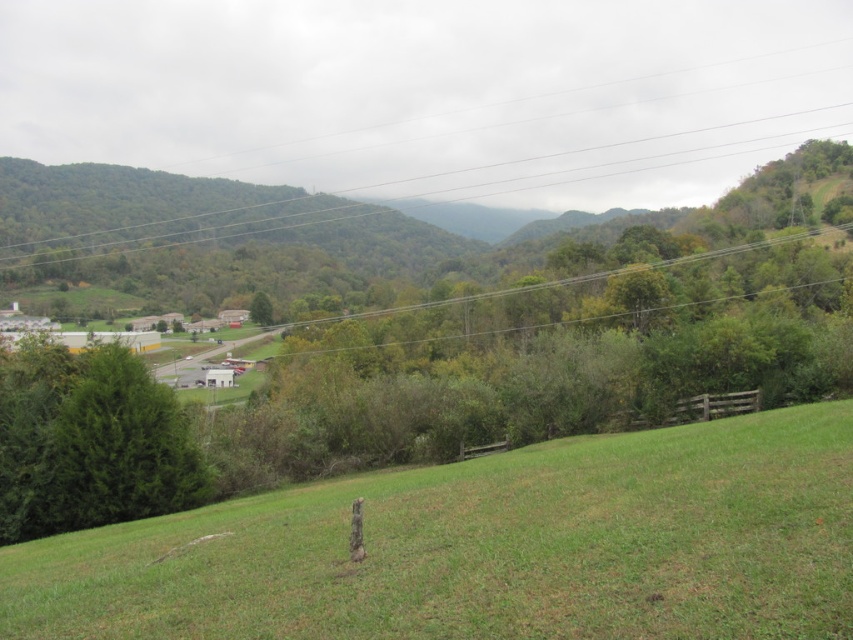
Question: Among these objects, which one is nearest to the camera?

Choices:
 (A) green matte tree at center
 (B) green matte tree at lower left

Answer: (B)

Question: Which point appears closest to the camera in this image?

Choices:
 (A) (142, 403)
 (B) (566, 474)
 (C) (258, 310)

Answer: (B)

Question: Is green grassy field at center above green matte tree at center?

Choices:
 (A) no
 (B) yes

Answer: (A)

Question: Can you confirm if green grassy field at center is bigger than green matte tree at center?

Choices:
 (A) no
 (B) yes

Answer: (A)

Question: Which point appears closest to the camera in this image?

Choices:
 (A) (141, 374)
 (B) (787, 416)

Answer: (B)

Question: Is green grassy field at center to the left of green matte tree at center from the viewer's perspective?

Choices:
 (A) no
 (B) yes

Answer: (A)